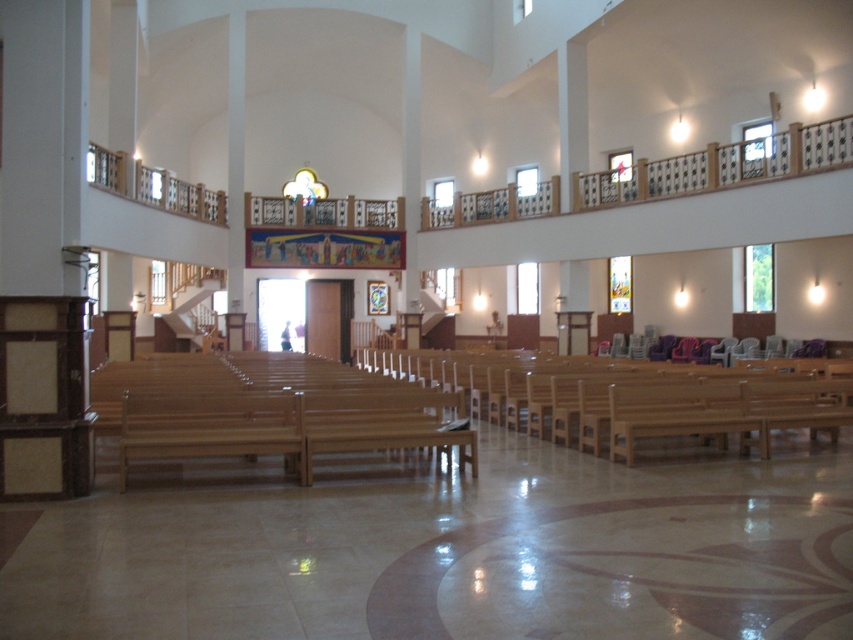
Between wooden at center and wooden church bench at center, which one appears on the right side from the viewer's perspective?

Positioned to the right is wooden church bench at center.

What do you see at coordinates (270, 410) in the screenshot? This screenshot has width=853, height=640. I see `wooden at center` at bounding box center [270, 410].

Is point (279, 364) positioned before point (844, 403)?

No.

What are the coordinates of `wooden at center` in the screenshot? It's located at (270, 410).